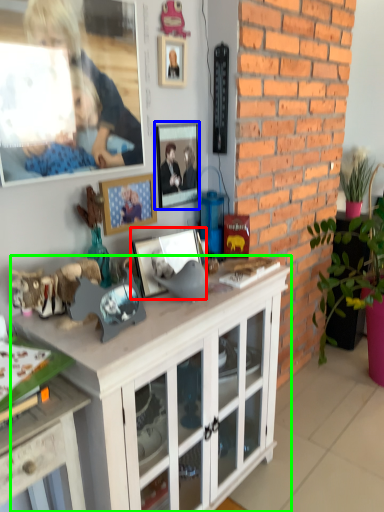
Question: Based on their relative distances, which object is nearer to picture frame (highlighted by a red box)? Choose from picture frame (highlighted by a blue box) and cabinetry (highlighted by a green box).

Choices:
 (A) picture frame
 (B) cabinetry

Answer: (A)